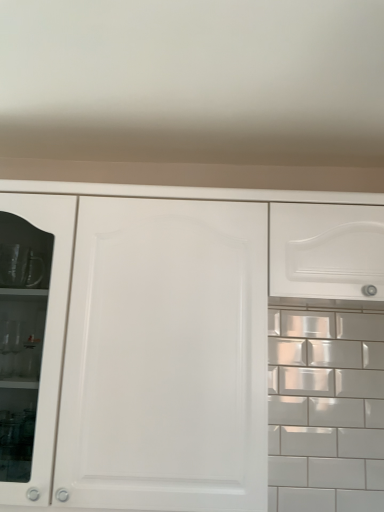
From the picture: In order to face white glossy drawer at upper right, should I rotate leftwards or rightwards?

Rotate your view right by about 18.561°.

I want to click on white glossy drawer at upper right, so point(326,251).

Measure the distance between point (308, 264) and camera.

4.32 feet.

What is the approximate height of white glossy drawer at upper right?

white glossy drawer at upper right is 13.97 inches in height.

What do you see at coordinates (326, 251) in the screenshot?
I see `white glossy drawer at upper right` at bounding box center [326, 251].

Measure the distance between white glossy drawer at upper right and camera.

4.22 feet.

At what (x,y) coordinates should I click in order to perform the action: click on white matte cabinet at center. Please return your answer as a coordinate pair (x, y). Looking at the image, I should click on (166, 333).

This screenshot has height=512, width=384. Describe the element at coordinates (166, 333) in the screenshot. I see `white matte cabinet at center` at that location.

Locate an element on the screen. This screenshot has width=384, height=512. white glossy drawer at upper right is located at coordinates (326, 251).

Considering the positions of objects white matte cabinet at center and white glossy drawer at upper right in the image provided, who is more to the right, white matte cabinet at center or white glossy drawer at upper right?

Positioned to the right is white glossy drawer at upper right.

Which is in front, white matte cabinet at center or white glossy drawer at upper right?

white matte cabinet at center is closer to the camera.

Which point is more forward, [323,217] or [362,224]?

The point [362,224] is closer to the camera.

Based on the photo, from the image's perspective, is white matte cabinet at center beneath white glossy drawer at upper right?

Yes, from the image's perspective, white matte cabinet at center is beneath white glossy drawer at upper right.

From a real-world perspective, relative to white glossy drawer at upper right, is white matte cabinet at center vertically above or below?

From a real-world perspective, white matte cabinet at center is physically below white glossy drawer at upper right.

In the scene shown: Looking at their sizes, would you say white matte cabinet at center is wider or thinner than white glossy drawer at upper right?

Considering their sizes, white matte cabinet at center looks broader than white glossy drawer at upper right.

Considering the sizes of white matte cabinet at center and white glossy drawer at upper right in the image, is white matte cabinet at center taller or shorter than white glossy drawer at upper right?

Considering their sizes, white matte cabinet at center has more height than white glossy drawer at upper right.

Is white matte cabinet at center bigger or smaller than white glossy drawer at upper right?

Considering their sizes, white matte cabinet at center takes up more space than white glossy drawer at upper right.

Which is correct: white matte cabinet at center is inside white glossy drawer at upper right, or outside of it?

white matte cabinet at center is located beyond the bounds of white glossy drawer at upper right.

From the picture: Is white matte cabinet at center positioned far away from white glossy drawer at upper right?

That's not correct — white matte cabinet at center is a little close to white glossy drawer at upper right.

Is white glossy drawer at upper right at the back of white matte cabinet at center?

No, white matte cabinet at center is not facing the opposite direction of white glossy drawer at upper right.

Locate an element on the screen. The height and width of the screenshot is (512, 384). drawer located above the white matte cabinet at center (from a real-world perspective) is located at coordinates (326, 251).

Can you confirm if white glossy drawer at upper right is positioned to the right of white matte cabinet at center?

Yes, white glossy drawer at upper right is to the right of white matte cabinet at center.

Does white glossy drawer at upper right come in front of white matte cabinet at center?

That is False.

Is point (330, 256) positioned after point (95, 478)?

That is True.

From the image's perspective, relative to white matte cabinet at center, is white glossy drawer at upper right above or below?

Based on their image positions, white glossy drawer at upper right is located above white matte cabinet at center.

From a real-world perspective, is white glossy drawer at upper right beneath white matte cabinet at center?

No.

Can you confirm if white glossy drawer at upper right is wider than white matte cabinet at center?

No, white glossy drawer at upper right is not wider than white matte cabinet at center.

Looking at this image, considering the sizes of objects white glossy drawer at upper right and white matte cabinet at center in the image provided, who is taller, white glossy drawer at upper right or white matte cabinet at center?

white matte cabinet at center is taller.

Considering the sizes of objects white glossy drawer at upper right and white matte cabinet at center in the image provided, who is bigger, white glossy drawer at upper right or white matte cabinet at center?

With larger size is white matte cabinet at center.

Choose the correct answer: Is white glossy drawer at upper right inside white matte cabinet at center or outside it?

white glossy drawer at upper right is not inside white matte cabinet at center, it's outside.

Consider the image. Is white glossy drawer at upper right positioned far away from white matte cabinet at center?

They are positioned close to each other.

Is white glossy drawer at upper right facing towards white matte cabinet at center?

No, white glossy drawer at upper right is not facing towards white matte cabinet at center.

How many degrees apart are the facing directions of white glossy drawer at upper right and white matte cabinet at center?

The angular difference between white glossy drawer at upper right and white matte cabinet at center is 0.000147 degrees.

Where is `drawer above the white matte cabinet at center (from a real-world perspective)`? The image size is (384, 512). drawer above the white matte cabinet at center (from a real-world perspective) is located at coordinates (326, 251).

At what (x,y) coordinates should I click in order to perform the action: click on cabinetry that appears below the white glossy drawer at upper right (from a real-world perspective). Please return your answer as a coordinate pair (x, y). The width and height of the screenshot is (384, 512). Looking at the image, I should click on (166, 333).

Find the location of a particular element. The image size is (384, 512). drawer that is above the white matte cabinet at center (from a real-world perspective) is located at coordinates (326, 251).